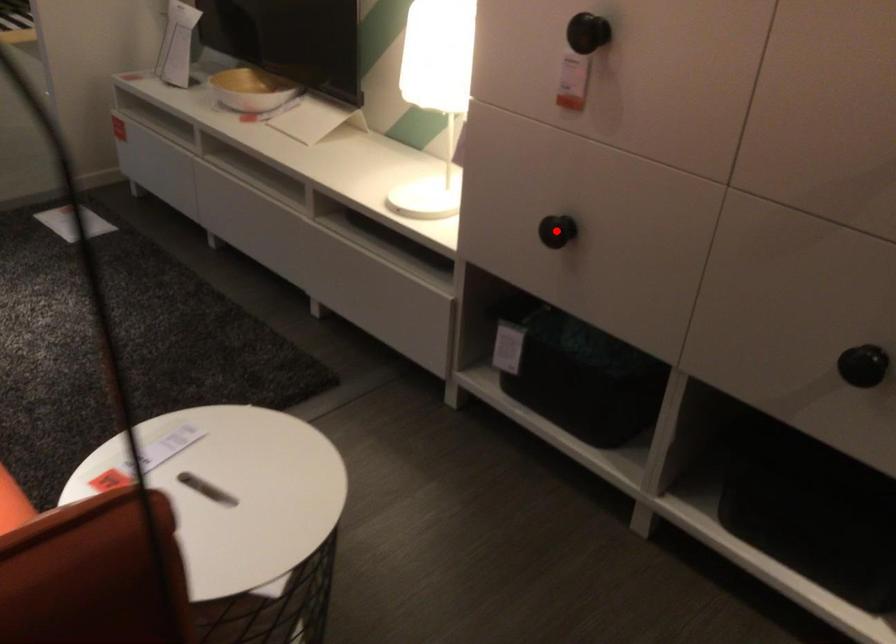
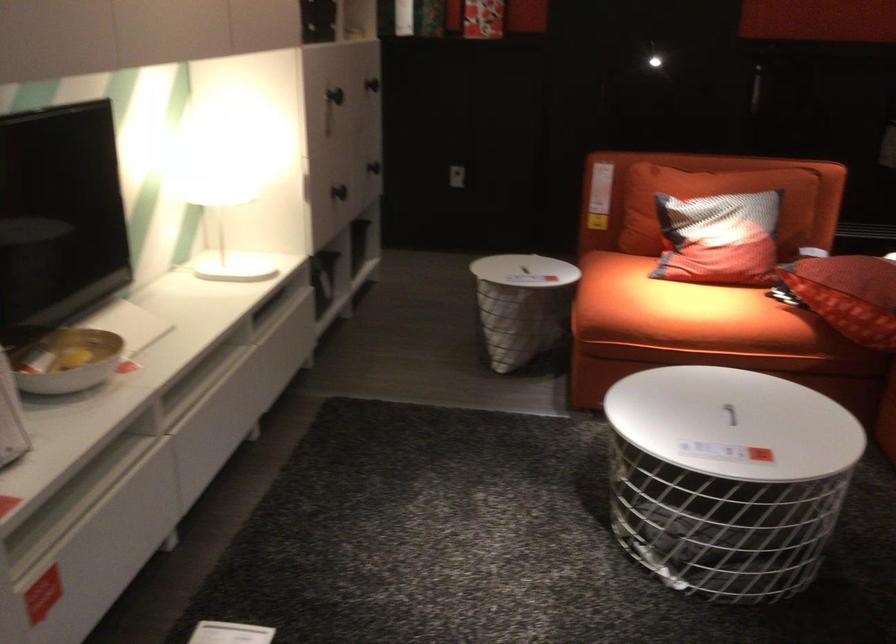
The point at the highlighted location is marked in the first image. Where is the corresponding point in the second image?

(358, 180)